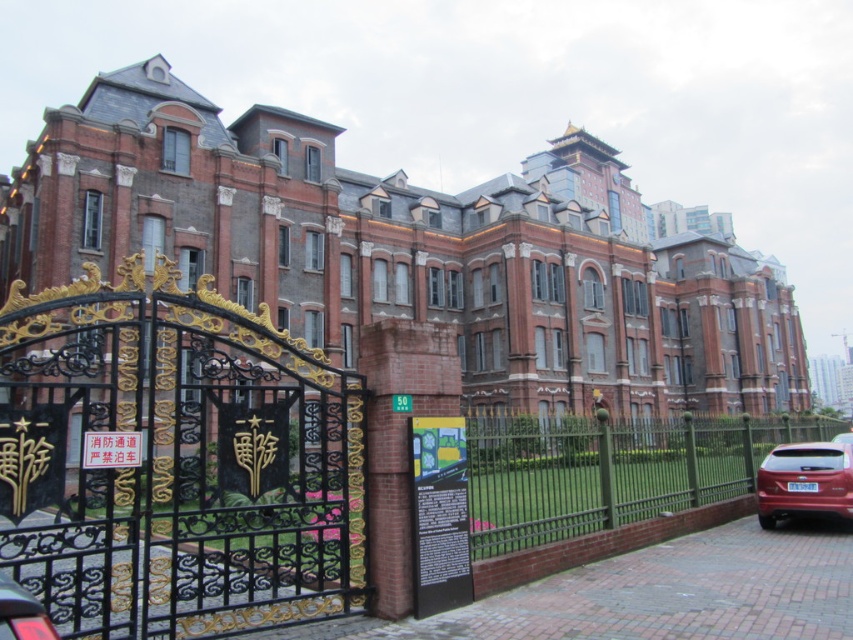
You are standing in front of the grand building and notice two points marked on the image. The first point is at coordinates point[270,440] and the second is at point[798,508]. Which point is closer to you?

Point[270,440] is closer to the viewer than point[798,508].

You are driving a shiny red suv at right and want to enter through the black wrought iron gate at left. Can your vehicle pass through the gate?

The black wrought iron gate at left might be wider than shiny red suv at right, so it is possible that the shiny red suv at right can pass through the gate.